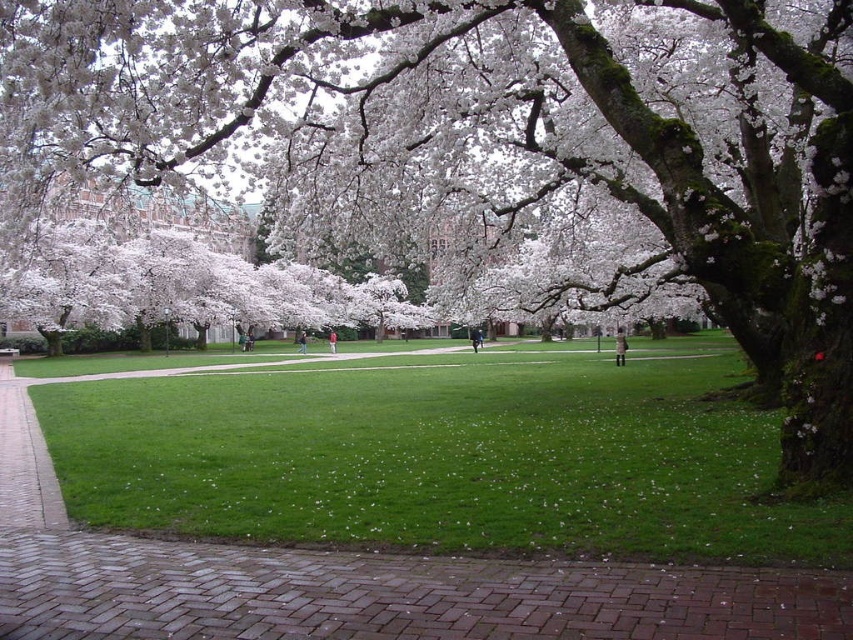
You are planning to place a small garden bench in the park. The bench is 1.5 meters long. Considering the available space, can you fit the bench on the green grassy field at center or the brick at lower center?

The green grassy field at center is bigger than the brick at lower center. Therefore, the bench can be placed on the green grassy field at center as it has sufficient space, but the brick at lower center is too small to accommodate the bench.

You are standing in the park and want to walk towards the large tree on the right. Which surface will you step on first, the green grassy field at center or the brick at lower center?

You will step on the brick at lower center first because it is closer to you than the green grassy field at center, which is further away.

You are a gardener who needs to place a decorative rock on the brick at lower center. However, you notice that the green grassy field at center is above it. Will the decorative rock be visible from above if placed there?

The green grassy field at center is located above brick at lower center, so placing the decorative rock on the brick at lower center would mean it is under the green grassy field at center. Therefore, the decorative rock would not be visible from above.